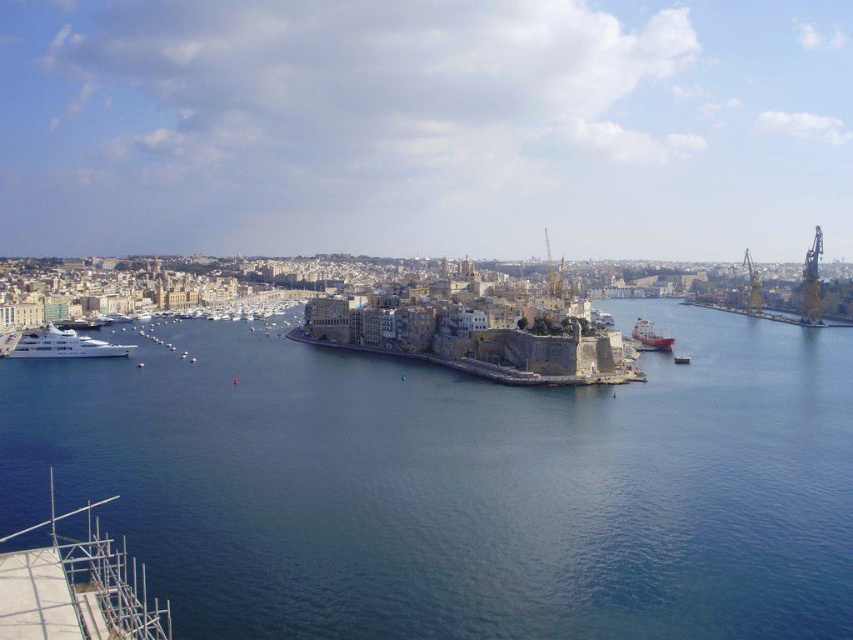
You are standing at the edge of the harbor in Valletta, looking out at the scene. There are two points marked in the image, one at coordinates point [639,611] and another at point [801,307]. Which of these points is nearer to your current position?

Point [639,611] is closer to the camera than point [801,307], so the point at coordinates point [639,611] is nearer to your current position.

You are a tour guide leading a group on a sightseeing boat in the harbor. You want to point out both the blue water at center and the red matte ship at center to your group. If you are standing on the bow of your boat, which object is closer to you?

The blue water at center is 78.29 meters away from the red matte ship at center. Since you are on the bow of your boat, the red matte ship at center is closer to you than the blue water at center.